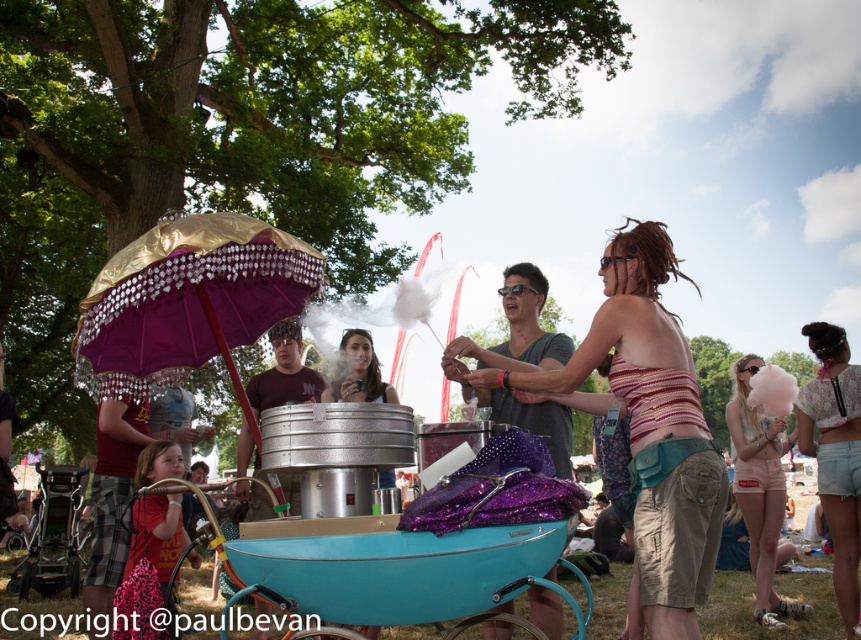
You are a photographer trying to capture a photo of the striped fabric bikini top at center and the white lace top at right. Which one should you zoom in on to ensure both are in frame without moving the camera?

The striped fabric bikini top at center is wider than the white lace top at right, so zooming in on the striped fabric bikini top at center will ensure both are in frame without moving the camera.

In the scene shown: You are a photographer at the festival and want to capture the person making cotton candy. Which clothing item is higher up on their body, the white lace top at right or the light pink denim shorts at lower right?

The white lace top at right is positioned over the light pink denim shorts at lower right, so the white lace top at right is higher up on their body.